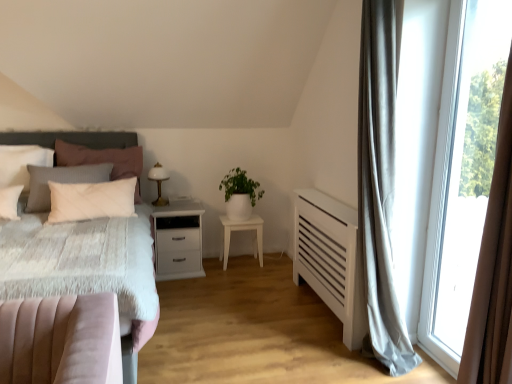
Question: Is white glossy table lamp at center further to camera compared to dark gray textured headboard at left?

Choices:
 (A) yes
 (B) no

Answer: (A)

Question: Does white glossy table lamp at center appear on the right side of dark gray textured headboard at left?

Choices:
 (A) no
 (B) yes

Answer: (B)

Question: Does white glossy table lamp at center lie in front of dark gray textured headboard at left?

Choices:
 (A) no
 (B) yes

Answer: (A)

Question: Can you confirm if white glossy table lamp at center is smaller than dark gray textured headboard at left?

Choices:
 (A) yes
 (B) no

Answer: (A)

Question: Is white glossy table lamp at center with dark gray textured headboard at left?

Choices:
 (A) no
 (B) yes

Answer: (A)

Question: Is white glossy table lamp at center positioned far away from dark gray textured headboard at left?

Choices:
 (A) yes
 (B) no

Answer: (B)

Question: Is white matte nightstand at center, which is the first nightstand from left to right, at the back of white matte plant at center?

Choices:
 (A) yes
 (B) no

Answer: (B)

Question: From the image's perspective, is white matte plant at center over white matte nightstand at center, which is counted as the 2th nightstand, starting from the right?

Choices:
 (A) yes
 (B) no

Answer: (A)

Question: From the image's perspective, does white matte plant at center appear lower than white matte nightstand at center, which is the first nightstand from left to right?

Choices:
 (A) yes
 (B) no

Answer: (B)

Question: Can white matte nightstand at center, which is the first nightstand from left to right, be found inside white matte plant at center?

Choices:
 (A) yes
 (B) no

Answer: (B)

Question: Can you confirm if white matte plant at center is bigger than white matte nightstand at center, which is counted as the 2th nightstand, starting from the right?

Choices:
 (A) no
 (B) yes

Answer: (A)

Question: From a real-world perspective, is white matte plant at center located beneath white matte nightstand at center, which is the first nightstand from left to right?

Choices:
 (A) no
 (B) yes

Answer: (A)

Question: Considering the relative sizes of dark gray textured headboard at left and white matte nightstand at center, which is counted as the 2th nightstand, starting from the right, in the image provided, is dark gray textured headboard at left thinner than white matte nightstand at center, which is counted as the 2th nightstand, starting from the right,?

Choices:
 (A) yes
 (B) no

Answer: (A)